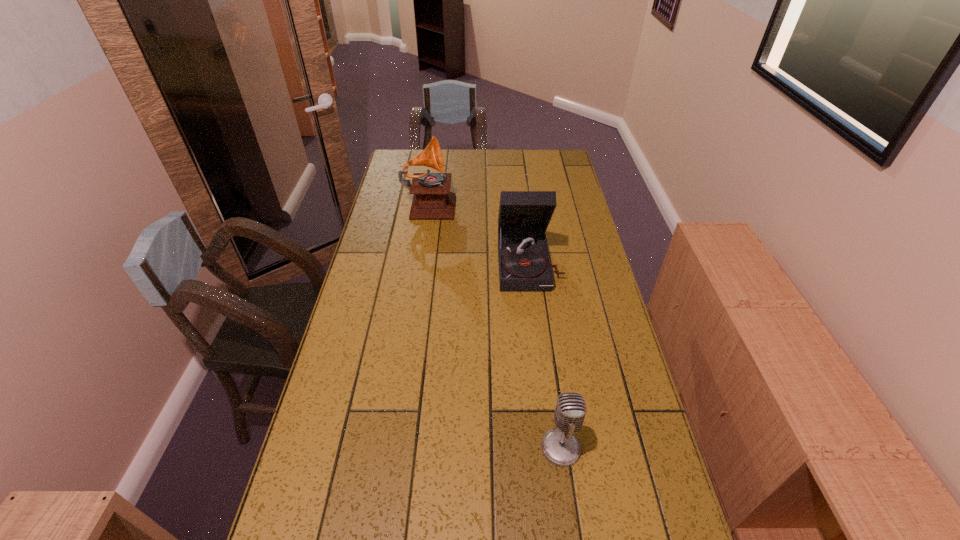
The width and height of the screenshot is (960, 540). I want to click on object that is positioned at the right edge, so click(524, 263).

This screenshot has height=540, width=960. In the image, there is a desktop. What are the coordinates of `vacant region at the far edge` in the screenshot? It's located at (529, 152).

Locate an element on the screen. The image size is (960, 540). free space at the left edge of the desktop is located at coordinates (389, 210).

The width and height of the screenshot is (960, 540). Find the location of `vacant space at the right edge of the desktop`. vacant space at the right edge of the desktop is located at coordinates (610, 362).

Find the location of a particular element. The width and height of the screenshot is (960, 540). blank area at the far right corner is located at coordinates (539, 155).

This screenshot has width=960, height=540. In order to click on free space that is in between the right phonograph_record and the leftmost object in this screenshot , I will do `click(479, 233)`.

The image size is (960, 540). Identify the location of vacant region between the right phonograph_record and the farther phonograph_record. (479, 233).

Where is `vacant area between the second nearest object and the farther phonograph_record`? The width and height of the screenshot is (960, 540). vacant area between the second nearest object and the farther phonograph_record is located at coordinates 479,233.

You are a GUI agent. You are given a task and a screenshot of the screen. Output one action in this format:
    pyautogui.click(x=<x>, y=<y>)
    Task: Click on the empty space that is in between the nearest object and the nearer phonograph_record
    
    Given the screenshot: What is the action you would take?
    pyautogui.click(x=545, y=355)

Where is `empty space between the right phonograph_record and the shortest object`? The width and height of the screenshot is (960, 540). empty space between the right phonograph_record and the shortest object is located at coordinates (545, 355).